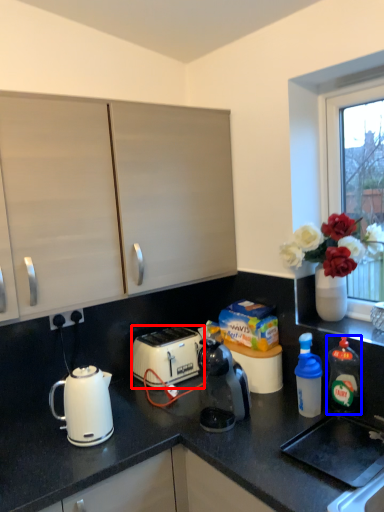
Question: Among these objects, which one is nearest to the camera, toaster (highlighted by a red box) or bottle (highlighted by a blue box)?

Choices:
 (A) toaster
 (B) bottle

Answer: (B)